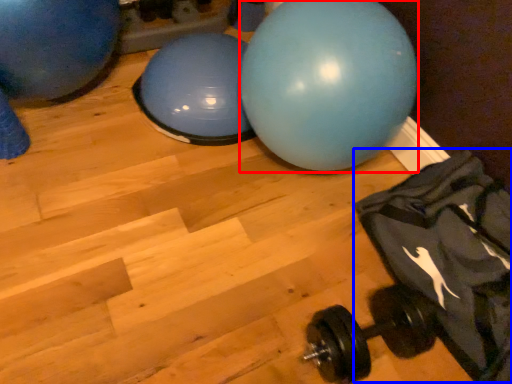
Question: Which of the following is the farthest to the observer, ball (highlighted by a red box) or bean bag chair (highlighted by a blue box)?

Choices:
 (A) ball
 (B) bean bag chair

Answer: (A)